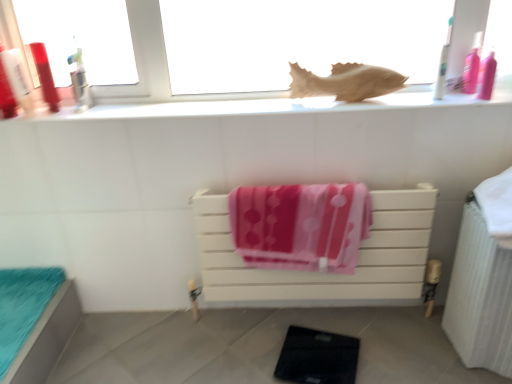
The height and width of the screenshot is (384, 512). I want to click on vacant area on top of white wooden towel rack at center, the first furniture positioned from the right (from a real-world perspective), so click(x=301, y=182).